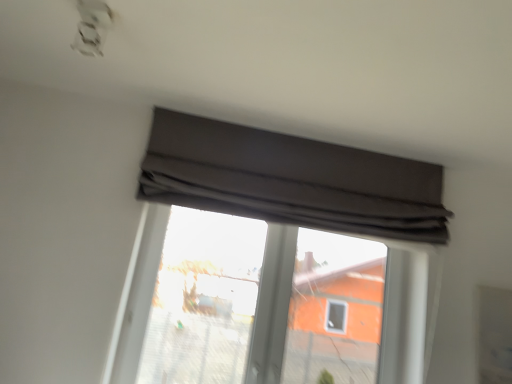
Locate an element on the screen. Image resolution: width=512 pixels, height=384 pixels. dark gray fabric at upper center is located at coordinates (291, 180).

What do you see at coordinates (291, 180) in the screenshot?
I see `dark gray fabric at upper center` at bounding box center [291, 180].

Where is `transparent glass window at center`? The height and width of the screenshot is (384, 512). transparent glass window at center is located at coordinates (204, 299).

The width and height of the screenshot is (512, 384). Describe the element at coordinates (204, 299) in the screenshot. I see `transparent glass window at center` at that location.

Image resolution: width=512 pixels, height=384 pixels. In order to click on dark gray fabric at upper center in this screenshot , I will do `click(291, 180)`.

Would you say dark gray fabric at upper center is to the left or to the right of transparent glass window at center in the picture?

dark gray fabric at upper center is to the right of transparent glass window at center.

Which object is more forward, dark gray fabric at upper center or transparent glass window at center?

dark gray fabric at upper center is more forward.

Is point (286, 147) behind point (351, 288)?

No.

From the image's perspective, is dark gray fabric at upper center above or below transparent glass window at center?

Clearly, from the image's perspective, dark gray fabric at upper center is above transparent glass window at center.

From a real-world perspective, is dark gray fabric at upper center physically located above or below transparent glass window at center?

Clearly, from a real-world perspective, dark gray fabric at upper center is above transparent glass window at center.

Which object is wider, dark gray fabric at upper center or transparent glass window at center?

dark gray fabric at upper center.

Between dark gray fabric at upper center and transparent glass window at center, which one has more height?

transparent glass window at center is taller.

Considering the relative sizes of dark gray fabric at upper center and transparent glass window at center in the image provided, is dark gray fabric at upper center bigger than transparent glass window at center?

Yes.

Can transparent glass window at center be found inside dark gray fabric at upper center?

No, dark gray fabric at upper center does not contain transparent glass window at center.

Are dark gray fabric at upper center and transparent glass window at center far apart?

No, there isn't a large distance between dark gray fabric at upper center and transparent glass window at center.

In the scene shown: Is dark gray fabric at upper center facing away from transparent glass window at center?

No, dark gray fabric at upper center's orientation is not away from transparent glass window at center.

How many degrees apart are the facing directions of dark gray fabric at upper center and transparent glass window at center?

The facing directions of dark gray fabric at upper center and transparent glass window at center are 0.000199 degrees apart.

Where is `window located above the transparent glass window at center (from a real-world perspective)`? This screenshot has width=512, height=384. window located above the transparent glass window at center (from a real-world perspective) is located at coordinates (291, 180).

Which object is positioned more to the left, transparent glass window at center or dark gray fabric at upper center?

From the viewer's perspective, transparent glass window at center appears more on the left side.

From the picture: Between transparent glass window at center and dark gray fabric at upper center, which one is positioned in front?

dark gray fabric at upper center is in front.

Does point (242, 247) lie behind point (396, 216)?

Yes.

From the image's perspective, does transparent glass window at center appear lower than dark gray fabric at upper center?

Indeed, from the image's perspective, transparent glass window at center is shown beneath dark gray fabric at upper center.

From a real-world perspective, is transparent glass window at center above or below dark gray fabric at upper center?

From a real-world perspective, transparent glass window at center is physically below dark gray fabric at upper center.

Considering the sizes of objects transparent glass window at center and dark gray fabric at upper center in the image provided, who is wider, transparent glass window at center or dark gray fabric at upper center?

With larger width is dark gray fabric at upper center.

Looking at this image, considering the sizes of objects transparent glass window at center and dark gray fabric at upper center in the image provided, who is shorter, transparent glass window at center or dark gray fabric at upper center?

With less height is dark gray fabric at upper center.

Is transparent glass window at center bigger than dark gray fabric at upper center?

No.

Is transparent glass window at center inside or outside of dark gray fabric at upper center?

transparent glass window at center is outside dark gray fabric at upper center.

Would you consider transparent glass window at center to be distant from dark gray fabric at upper center?

No.

Is transparent glass window at center oriented away from dark gray fabric at upper center?

That's not correct — transparent glass window at center is not looking away from dark gray fabric at upper center.

In the scene shown: Can you tell me how much transparent glass window at center and dark gray fabric at upper center differ in facing direction?

0.000199 degrees.

In the image, there is a dark gray fabric at upper center. Where is `bay window below it (from the image's perspective)`? bay window below it (from the image's perspective) is located at coordinates coord(204,299).

What are the coordinates of `window lying on the right of transparent glass window at center` in the screenshot? It's located at (291, 180).

The image size is (512, 384). Identify the location of window in front of the transparent glass window at center. (291, 180).